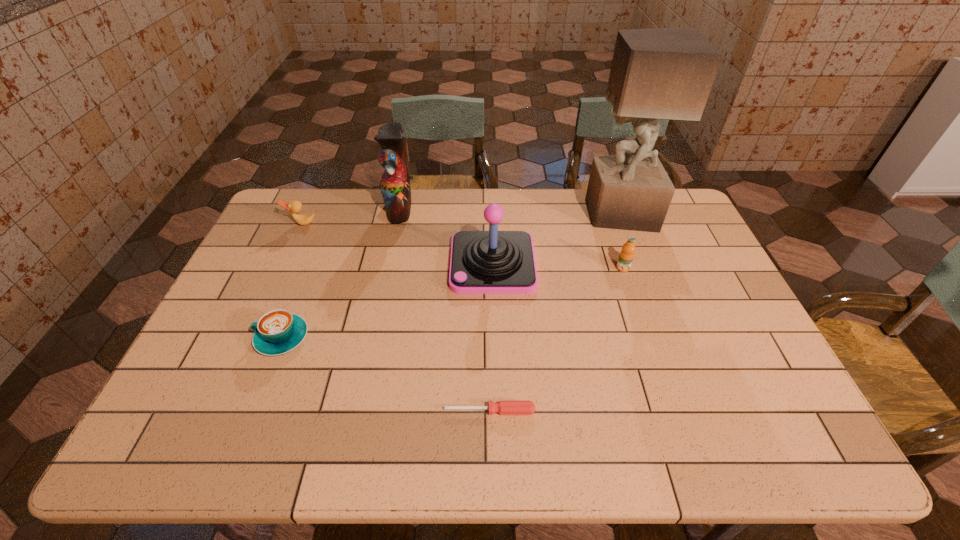
The image size is (960, 540). What are the coordinates of `vacant space that's between the third tallest object and the duck` in the screenshot? It's located at (397, 244).

I want to click on free space between the cappuccino and the shortest object, so click(x=386, y=374).

Find the location of `free space between the shortest object and the fourth tallest object`. free space between the shortest object and the fourth tallest object is located at coordinates (557, 340).

Locate an element on the screen. The width and height of the screenshot is (960, 540). the fourth closest object to the orange juice is located at coordinates (395, 184).

This screenshot has width=960, height=540. In order to click on object that is the nearest to the duck in this screenshot , I will do `click(395, 184)`.

The image size is (960, 540). I want to click on vacant space that satisfies the following two spatial constraints: 1. on the front-facing side of the tallest object; 2. on the beak of the duck, so click(622, 224).

The width and height of the screenshot is (960, 540). Find the location of `free spot that satisfies the following two spatial constraints: 1. at the face of the parrot; 2. on the back side of the nearest object`. free spot that satisfies the following two spatial constraints: 1. at the face of the parrot; 2. on the back side of the nearest object is located at coordinates pos(356,411).

You are a GUI agent. You are given a task and a screenshot of the screen. Output one action in this format:
    pyautogui.click(x=<x>, y=<y>)
    Task: Click on the vacant area in the image that satisfies the following two spatial constraints: 1. at the face of the third object from left to right; 2. on the beak of the duck
    
    Given the screenshot: What is the action you would take?
    pyautogui.click(x=396, y=224)